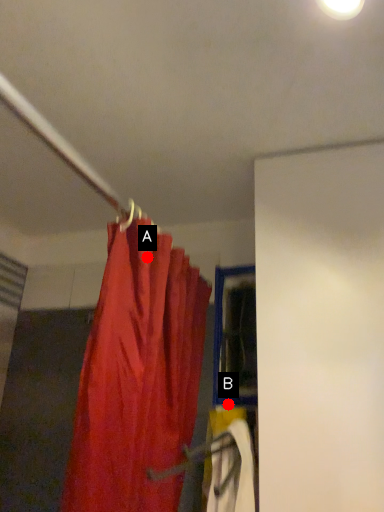
Question: Two points are circled on the image, labeled by A and B beside each circle. Which point is farther from the camera taking this photo?

Choices:
 (A) A is further
 (B) B is further

Answer: (B)